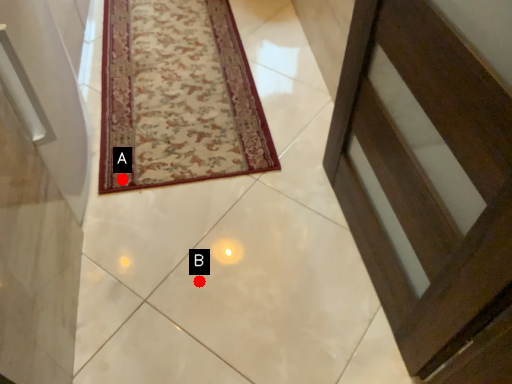
Question: Two points are circled on the image, labeled by A and B beside each circle. Which point appears farthest from the camera in this image?

Choices:
 (A) A is further
 (B) B is further

Answer: (A)